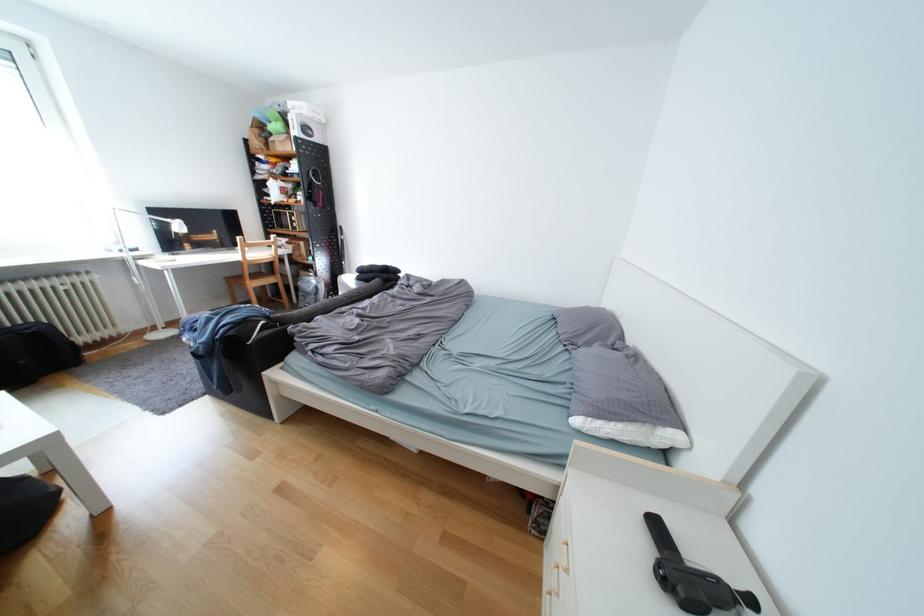
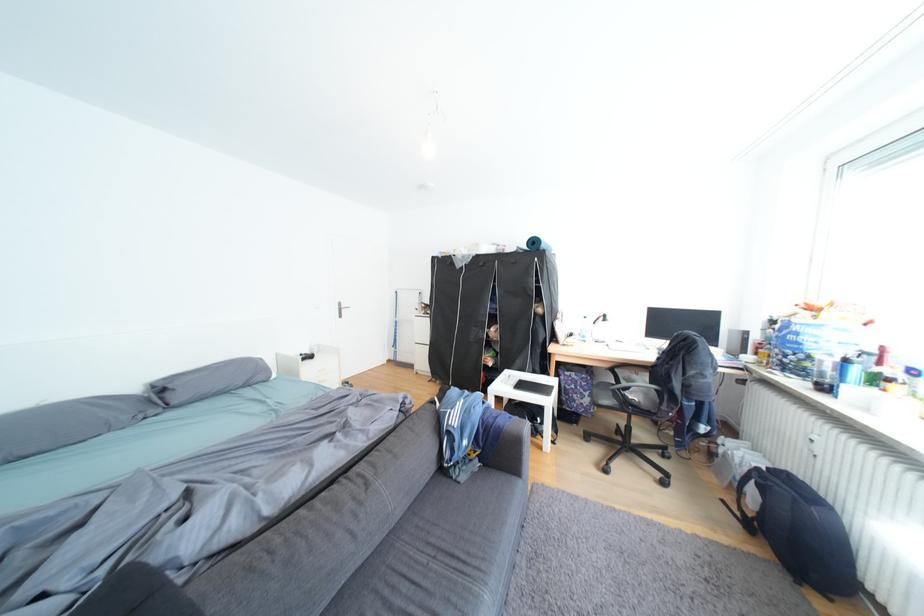
Question: I am providing you with two images of the same scene from different viewpoints. After the viewpoint changes to image2, which objects are now occluded?

Choices:
 (A) black wardrobe flap
 (B) black chair sitting surface
 (C) sewing machine cover
 (D) black handheld device

Answer: (D)